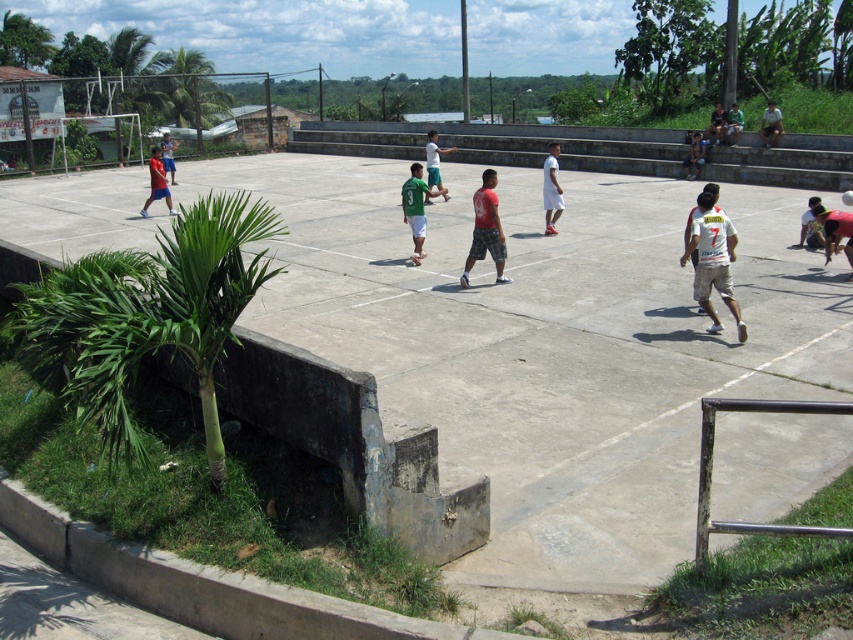
Looking at this image, you are a soccer player standing on the court and see the white jersey at right and the green matte shirt at center. Which player is closer to you?

The white jersey at right is closer to you because it is in front of the green matte shirt at center.